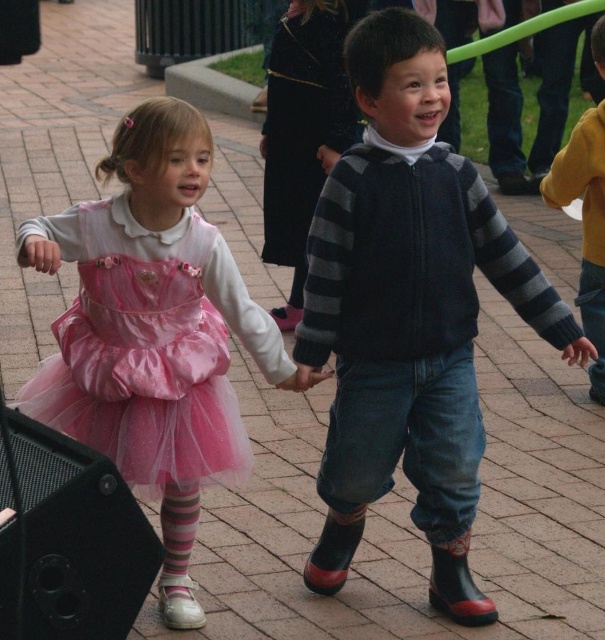
Between striped knit sweater at center and pink tulle dress at lower left, which one appears on the right side from the viewer's perspective?

striped knit sweater at center is more to the right.

Is striped knit sweater at center wider than pink tulle dress at lower left?

Yes.

Does point (325, 584) lie behind point (189, 460)?

Yes, it is behind point (189, 460).

Locate an element on the screen. The height and width of the screenshot is (640, 605). striped knit sweater at center is located at coordinates (408, 312).

Between pink tulle dress at lower left and yellow sweater at right, which one has less height?

Standing shorter between the two is pink tulle dress at lower left.

Between point (206, 401) and point (600, 61), which one is positioned in front?

Point (206, 401)

Locate an element on the screen. pink tulle dress at lower left is located at coordinates (142, 356).

Is striped knit sweater at center closer to the viewer compared to yellow sweater at right?

Yes, striped knit sweater at center is in front of yellow sweater at right.

Is striped knit sweater at center shorter than yellow sweater at right?

No.

Which is behind, point (370, 438) or point (549, 168)?

Point (549, 168)

Where is `striped knit sweater at center`? striped knit sweater at center is located at coordinates (408, 312).